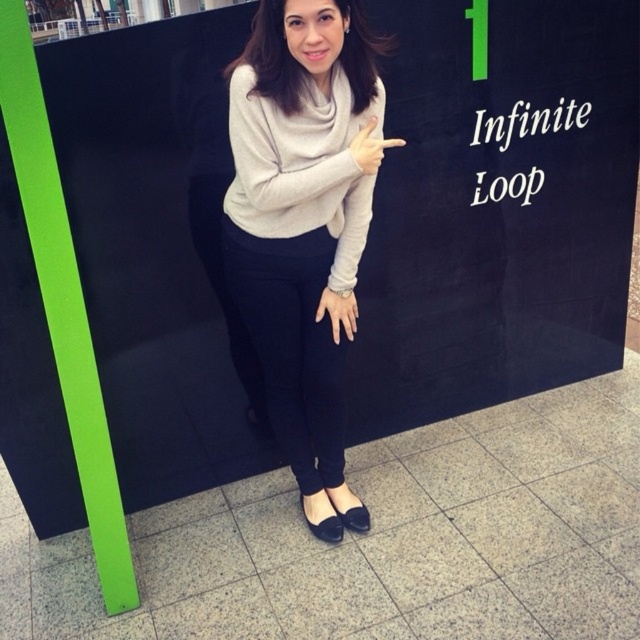
Can you confirm if matte gray sweater at center is positioned below light gray knit sweater at center?

→ Yes, matte gray sweater at center is below light gray knit sweater at center.

Does matte gray sweater at center have a greater height compared to light gray knit sweater at center?

Indeed, matte gray sweater at center has a greater height compared to light gray knit sweater at center.

Where is `matte gray sweater at center`? This screenshot has width=640, height=640. matte gray sweater at center is located at coordinates (301, 225).

Can you confirm if matte gray sweater at center is bigger than matte gray finger at upper center?

Yes.

Does point (352, 179) come behind point (400, 138)?

No, it is not.

Does point (349, 33) come behind point (364, 163)?

Yes, point (349, 33) is behind point (364, 163).

What are the coordinates of `matte gray sweater at center` in the screenshot? It's located at (301, 225).

Is light gray knit sweater at center to the right of matte gray finger at upper center from the viewer's perspective?

No, light gray knit sweater at center is not to the right of matte gray finger at upper center.

Does light gray knit sweater at center appear over matte gray finger at upper center?

Incorrect, light gray knit sweater at center is not positioned above matte gray finger at upper center.

Does point (248, 104) come closer to viewer compared to point (362, 152)?

Yes, it is in front of point (362, 152).

Image resolution: width=640 pixels, height=640 pixels. Identify the location of light gray knit sweater at center. (301, 166).